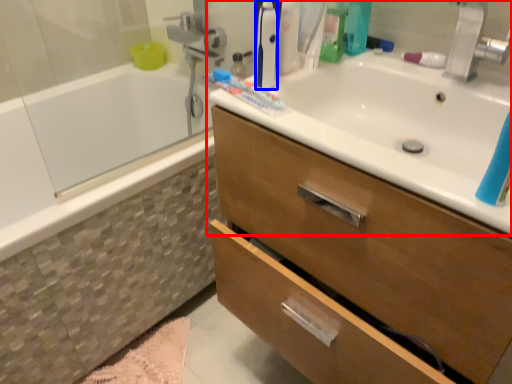
Question: Among these objects, which one is farthest to the camera, sink (highlighted by a red box) or toiletry (highlighted by a blue box)?

Choices:
 (A) sink
 (B) toiletry

Answer: (B)